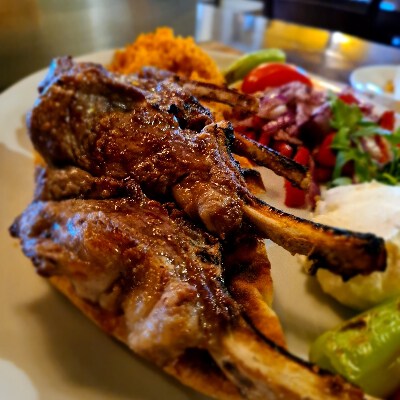
Where is `counter top`? Image resolution: width=400 pixels, height=400 pixels. counter top is located at coordinates (104, 371).